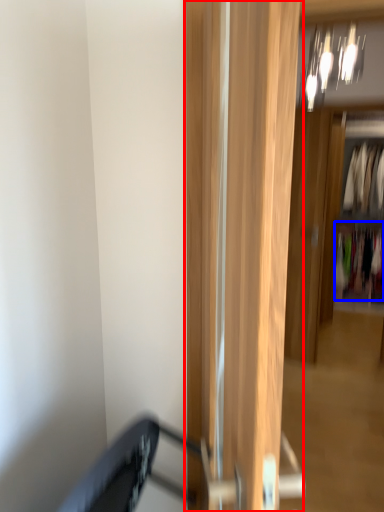
Question: Among these objects, which one is farthest to the camera, door (highlighted by a red box) or clothing (highlighted by a blue box)?

Choices:
 (A) door
 (B) clothing

Answer: (B)